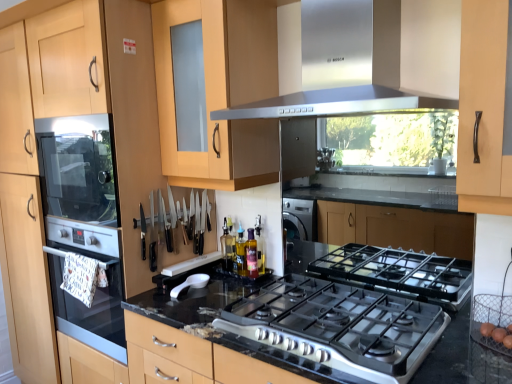
Where is `vacant area in front of white plastic spoon at center`? vacant area in front of white plastic spoon at center is located at coordinates (176, 309).